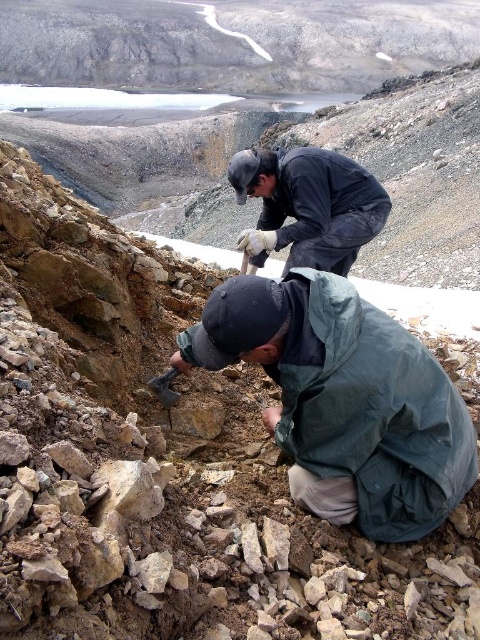
Identify the location of green fabric jacket at lower right. This screenshot has height=640, width=480. (370, 410).

Who is positioned more to the right, green fabric jacket at lower right or black matte jacket at upper center?

From the viewer's perspective, green fabric jacket at lower right appears more on the right side.

Identify the location of green fabric jacket at lower right. (370, 410).